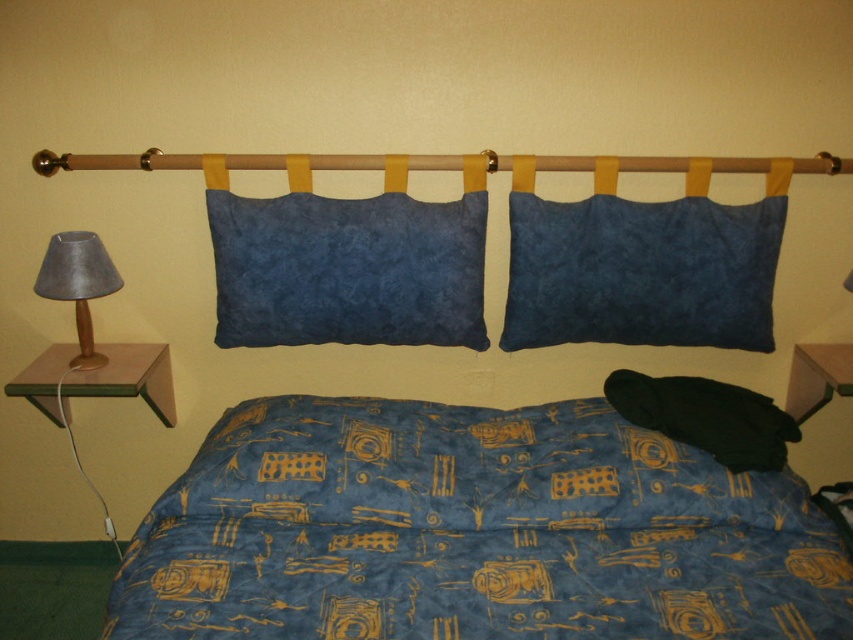
Question: Which object is positioned closest to the blue printed fabric quilt at center?

Choices:
 (A) dark blue suede pillow at upper center
 (B) suede blue pillow at center
 (C) matte gray lampshade at left

Answer: (B)

Question: Considering the real-world distances, which object is farthest from the suede blue pillow at center?

Choices:
 (A) blue printed fabric quilt at center
 (B) dark blue suede pillow at upper center

Answer: (A)

Question: Is blue printed fabric quilt at center positioned before suede blue pillow at center?

Choices:
 (A) yes
 (B) no

Answer: (A)

Question: Where is suede blue pillow at center located in relation to dark blue suede pillow at upper center in the image?

Choices:
 (A) left
 (B) right

Answer: (A)

Question: Is suede blue pillow at center above matte gray lampshade at left?

Choices:
 (A) no
 (B) yes

Answer: (B)

Question: Which point is closer to the camera?

Choices:
 (A) (782, 589)
 (B) (309, 275)
 (C) (94, 252)
 (D) (689, 196)

Answer: (A)